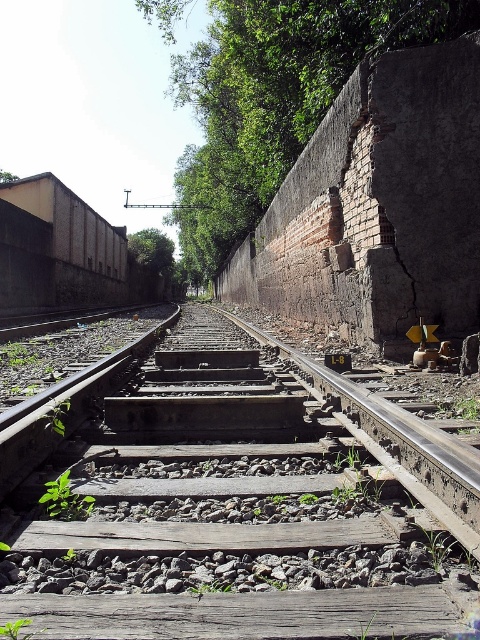
Does point (291, 550) come closer to viewer compared to point (301, 36)?

Yes, it is in front of point (301, 36).

Looking at this image, does brown wooden train track at center lie behind green leafy tree at upper center?

No, it is not.

The image size is (480, 640). Find the location of `brown wooden train track at center`. brown wooden train track at center is located at coordinates (228, 509).